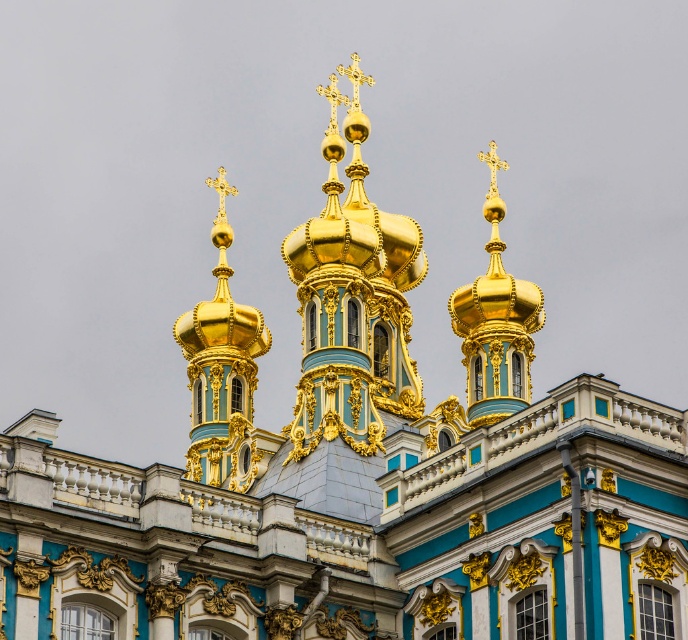
You are an architect analyzing the symmetry of the building. You notice the gold polished dome at upper left and the gold polished dome at upper center. Which dome has a larger diameter?

The gold polished dome at upper left might be wider than gold polished dome at upper center according to the description provided.

Based on the photo, you are standing in front of the building and notice two points marked on the facade. The first point is at coordinate point (186, 468) and the second is at point (497, 316). Which point is closer to you?

Point (497, 316) is closer to you because it is in front of point (186, 468).

You are an architect planning to install a new lighting fixture between the gold polished dome at upper left and the gold polished dome at upper center. The fixture requires a minimum of 40 feet of space between the two domes to be safely installed. Based on the scene description, can the lighting fixture be installed between these two domes?

The gold polished dome at upper left and gold polished dome at upper center are 43.34 feet apart, which exceeds the minimum required 40 feet. Therefore, the lighting fixture can be safely installed between them.